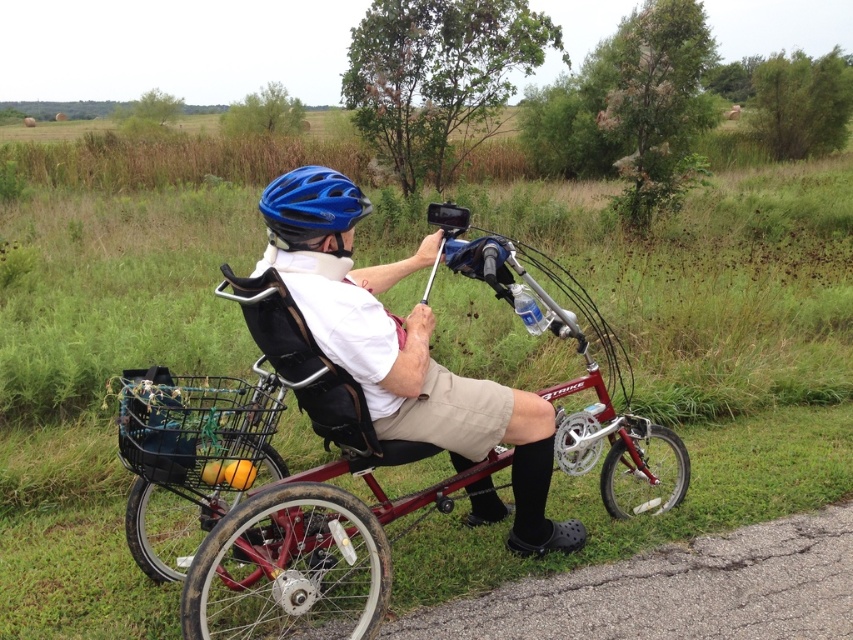
You are standing in front of the red recumbent tricycle and want to place a small item at the point closer to you between point (498,266) and point (367,204). Which point should you choose?

You should choose point (498,266) because it is closer to you than point (367,204).

You are a delivery person who needs to place a package in the black mesh basket at lower left. What are the coordinates where you should place the package?

The coordinates for placing the package in the black mesh basket at lower left are at point 0.667 on the x axis and 0.225 on the y axis.